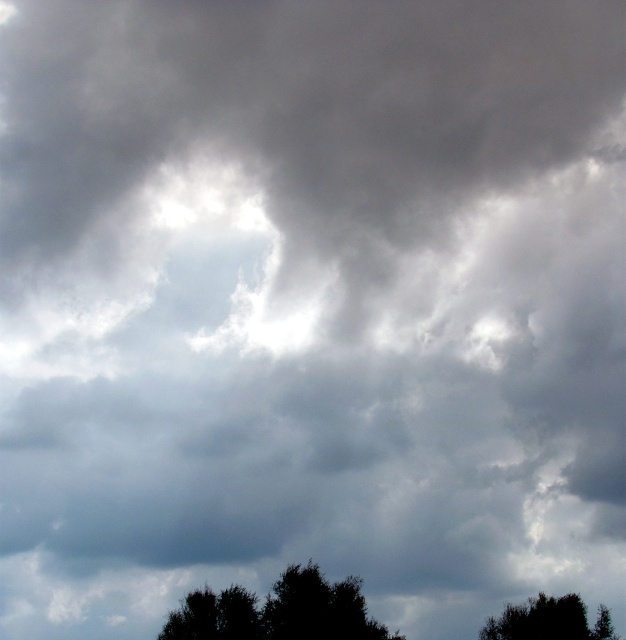
Question: Does silhouette leafy tree at lower center appear under green leafy tree at lower center?

Choices:
 (A) yes
 (B) no

Answer: (A)

Question: Is silhouette leafy tree at lower center thinner than green leafy tree at lower right?

Choices:
 (A) no
 (B) yes

Answer: (A)

Question: Which point appears farthest from the camera in this image?

Choices:
 (A) (314, 614)
 (B) (177, 636)
 (C) (577, 608)

Answer: (C)

Question: Among these objects, which one is farthest from the camera?

Choices:
 (A) silhouette leafy tree at lower center
 (B) green leafy tree at lower center

Answer: (B)

Question: Can you confirm if silhouette leafy tree at lower center is thinner than green leafy tree at lower right?

Choices:
 (A) yes
 (B) no

Answer: (B)

Question: Based on their relative distances, which object is farther from the silhouette leafy tree at lower center?

Choices:
 (A) green leafy tree at lower right
 (B) green leafy tree at lower center

Answer: (A)